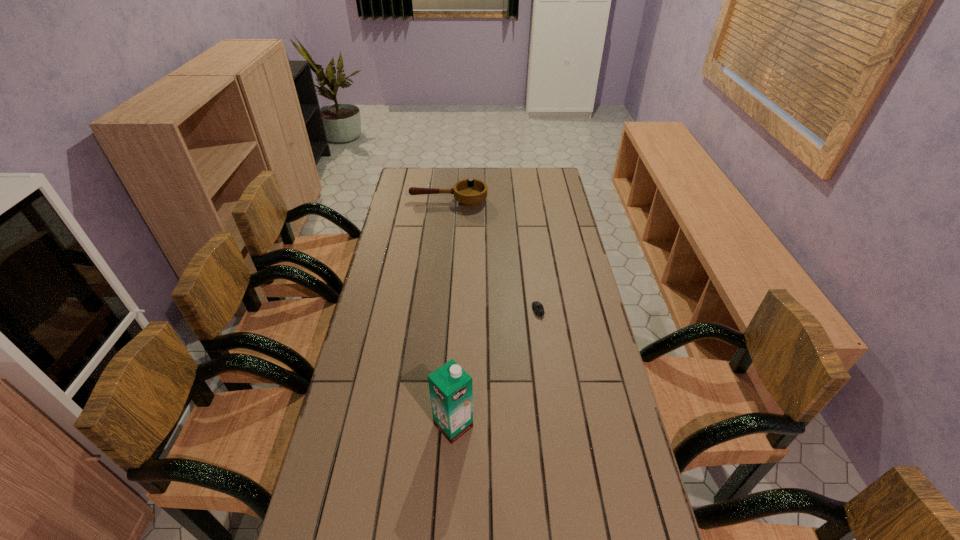
Where is `vacant area that lies between the tallest object and the computer mouse`? This screenshot has width=960, height=540. vacant area that lies between the tallest object and the computer mouse is located at coordinates (495, 368).

Find the location of a particular element. This screenshot has width=960, height=540. vacant area between the second tallest object and the rightmost object is located at coordinates (493, 256).

The width and height of the screenshot is (960, 540). I want to click on object that is the second closest to the second farthest object, so click(x=469, y=193).

Find the location of a particular element. object that is the second closest to the tallest object is located at coordinates (469, 193).

Where is `vacant point that satisfies the following two spatial constraints: 1. on the back side of the rightmost object; 2. on the left side of the carton`? vacant point that satisfies the following two spatial constraints: 1. on the back side of the rightmost object; 2. on the left side of the carton is located at coordinates (459, 312).